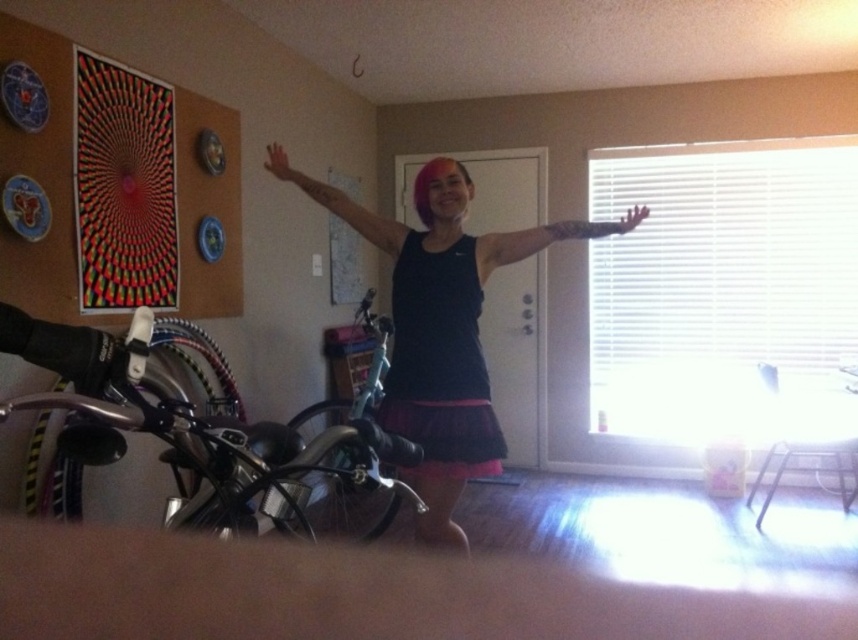
Which is more to the right, tattooed skin at center or pink matte hand at upper center?

Positioned to the right is tattooed skin at center.

Between tattooed skin at center and pink matte hand at upper center, which one is positioned lower?

tattooed skin at center

Between point (494, 243) and point (276, 152), which one is positioned in front?

Positioned in front is point (494, 243).

Identify the location of tattooed skin at center. (545, 237).

Who is shorter, black matte dress at center or matte black arm at center?

Standing shorter between the two is matte black arm at center.

Is black matte dress at center positioned in front of matte black arm at center?

Yes, it is in front of matte black arm at center.

What do you see at coordinates (440, 362) in the screenshot?
I see `black matte dress at center` at bounding box center [440, 362].

Identify the location of black matte dress at center. (440, 362).

Is black matte dress at center shorter than pink matte hand at upper center?

No, black matte dress at center is not shorter than pink matte hand at upper center.

Is black matte dress at center in front of pink matte hand at upper center?

That is True.

Locate an element on the screen. This screenshot has width=858, height=640. black matte dress at center is located at coordinates (440, 362).